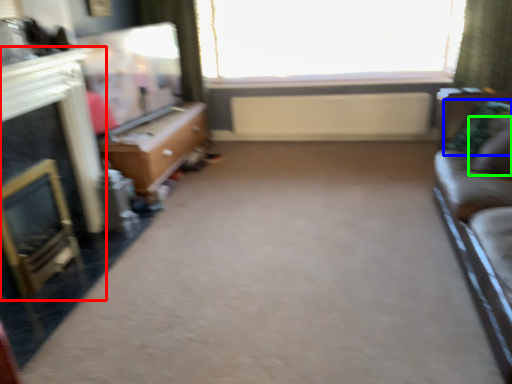
Question: Estimate the real-world distances between objects in this image. Which object is closer to fireplace (highlighted by a red box), pillow (highlighted by a blue box) or pillow (highlighted by a green box)?

Choices:
 (A) pillow
 (B) pillow

Answer: (A)